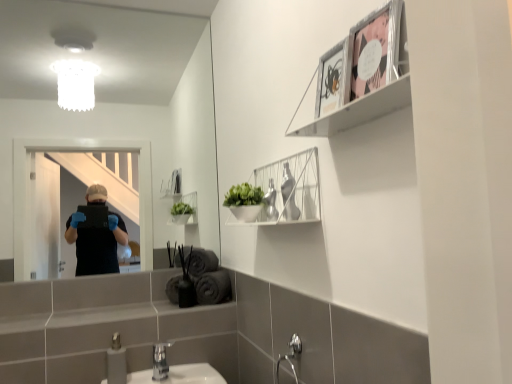
Question: Is point (123, 382) positioned closer to the camera than point (159, 350)?

Choices:
 (A) farther
 (B) closer

Answer: (B)

Question: Is brushed metal faucet at lower center spatially inside silver metallic faucet at lower center, or outside of it?

Choices:
 (A) inside
 (B) outside

Answer: (B)

Question: Estimate the real-world distances between objects in this image. Which object is farther from the metallic silver frame at upper right, the 2th cabinet ordered from the bottom?

Choices:
 (A) silver metallic faucet at lower center
 (B) metallic silver picture frame at upper right, the 2th picture frame when ordered from right to left
 (C) brushed metal faucet at lower center
 (D) white wire mesh shelf at upper center, the 2th cabinet from the top
 (E) clear glass mirror at upper center

Answer: (E)

Question: Considering the real-world distances, which object is closest to the white wire mesh shelf at upper center, the first cabinet in the bottom-to-top sequence?

Choices:
 (A) pink paper picture frame at upper right, the 2th picture frame in the left-to-right sequence
 (B) clear glass mirror at upper center
 (C) brushed metal faucet at lower center
 (D) silver metallic faucet at lower center
 (E) metallic silver picture frame at upper right, arranged as the first picture frame when viewed from the left

Answer: (E)